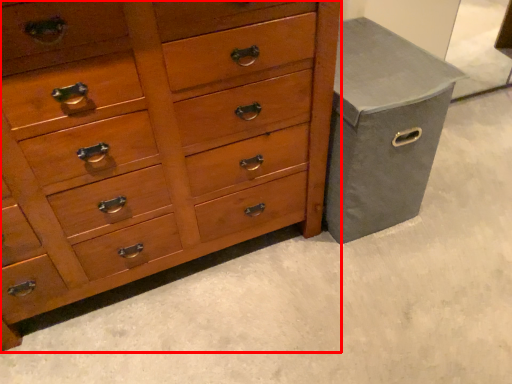
Question: Where is chest of drawers (annotated by the red box) located in relation to gray in the image?

Choices:
 (A) right
 (B) left

Answer: (B)